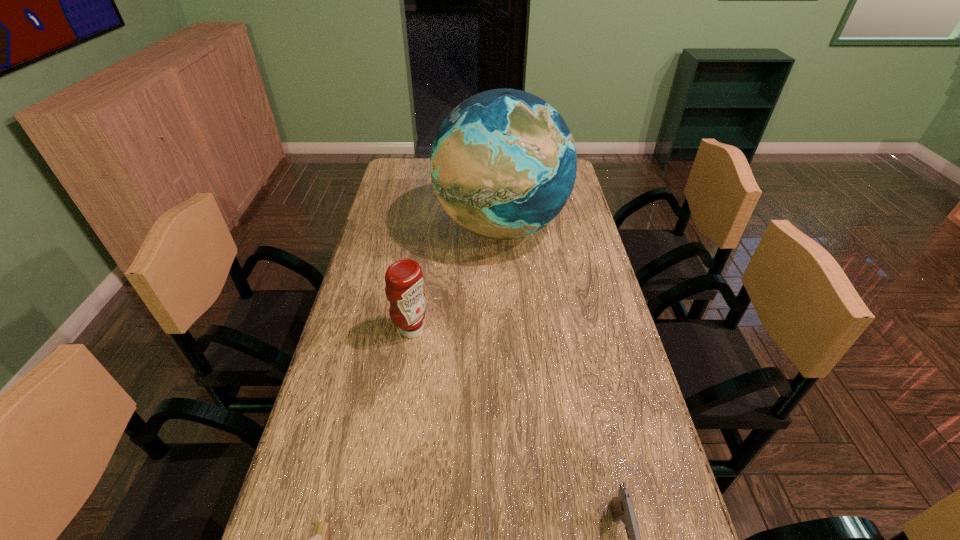
Where is `the farthest object`? the farthest object is located at coordinates (503, 163).

Locate an element on the screen. globe is located at coordinates [503, 163].

This screenshot has width=960, height=540. What are the coordinates of `the third nearest object` in the screenshot? It's located at click(x=404, y=280).

This screenshot has width=960, height=540. I want to click on condiment, so click(x=404, y=280).

Where is `free space located 0.070m on the back of the farthest object`? Image resolution: width=960 pixels, height=540 pixels. free space located 0.070m on the back of the farthest object is located at coordinates (498, 183).

At what (x,y) coordinates should I click in order to perform the action: click on vacant space located on the right of the condiment. Please return your answer as a coordinate pair (x, y). Looking at the image, I should click on (483, 330).

Find the location of a particular element. object that is at the left edge is located at coordinates (404, 280).

Locate an element on the screen. object present at the right edge is located at coordinates (503, 163).

You are a GUI agent. You are given a task and a screenshot of the screen. Output one action in this format:
    pyautogui.click(x=<x>, y=<y>)
    Task: Click on the vacant area at the left edge of the desktop
    The height and width of the screenshot is (540, 960).
    Given the screenshot: What is the action you would take?
    pyautogui.click(x=420, y=197)

Locate an element on the screen. Image resolution: width=960 pixels, height=540 pixels. vacant region at the right edge of the desktop is located at coordinates (569, 315).